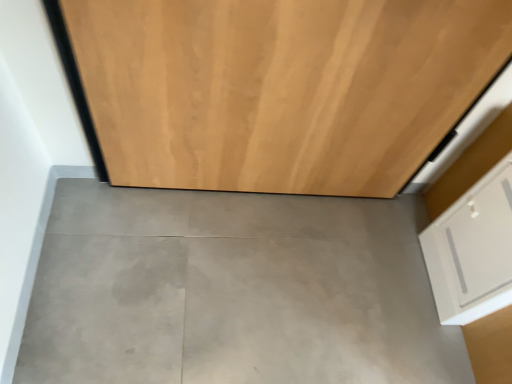
Identify the location of free space that is in between wooden door at center and white matte drawer at lower right. Image resolution: width=512 pixels, height=384 pixels. (322, 236).